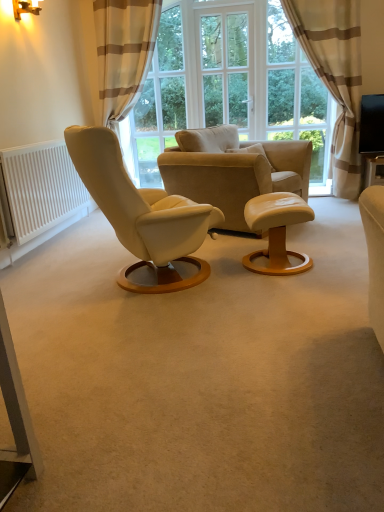
This screenshot has height=512, width=384. What are the coordinates of `free space in front of matte white stool at center` in the screenshot? It's located at (292, 290).